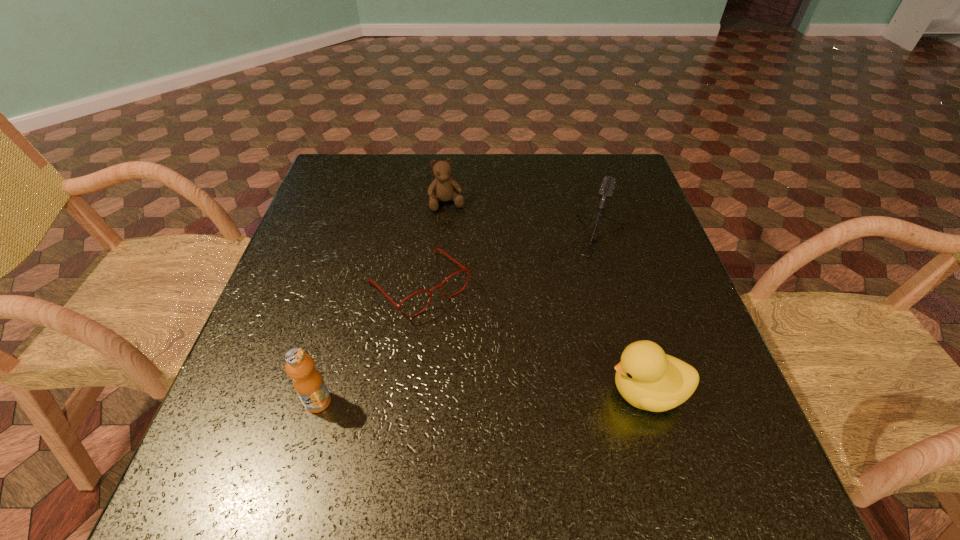
Image resolution: width=960 pixels, height=540 pixels. Find the location of `object that is at the left edge`. object that is at the left edge is located at coordinates (308, 383).

You are a GUI agent. You are given a task and a screenshot of the screen. Output one action in this format:
    pyautogui.click(x=<x>, y=<y>)
    Task: Click on the duck that is at the right edge
    
    Given the screenshot: What is the action you would take?
    pyautogui.click(x=647, y=378)

Identify the location of microphone positioned at the right edge. This screenshot has width=960, height=540. (606, 190).

Find the location of a particular element. object present at the near left corner is located at coordinates (308, 383).

This screenshot has height=540, width=960. Find the location of `object positioned at the near right corner`. object positioned at the near right corner is located at coordinates (647, 378).

In the image, there is a desktop. Where is `vacant space at the far edge`? The width and height of the screenshot is (960, 540). vacant space at the far edge is located at coordinates (492, 198).

In the image, there is a desktop. Where is `vacant space at the near edge`? This screenshot has width=960, height=540. vacant space at the near edge is located at coordinates (419, 428).

In the image, there is a desktop. Identify the location of vacant space at the left edge. (349, 221).

The image size is (960, 540). Identify the location of vacant space at the right edge of the desktop. (682, 284).

This screenshot has width=960, height=540. I want to click on vacant space at the far right corner of the desktop, so click(623, 155).